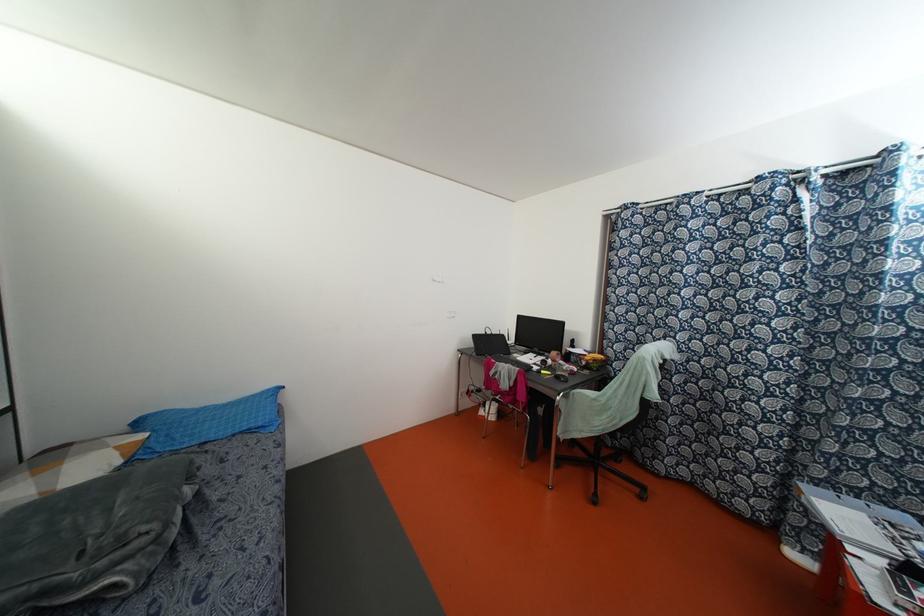
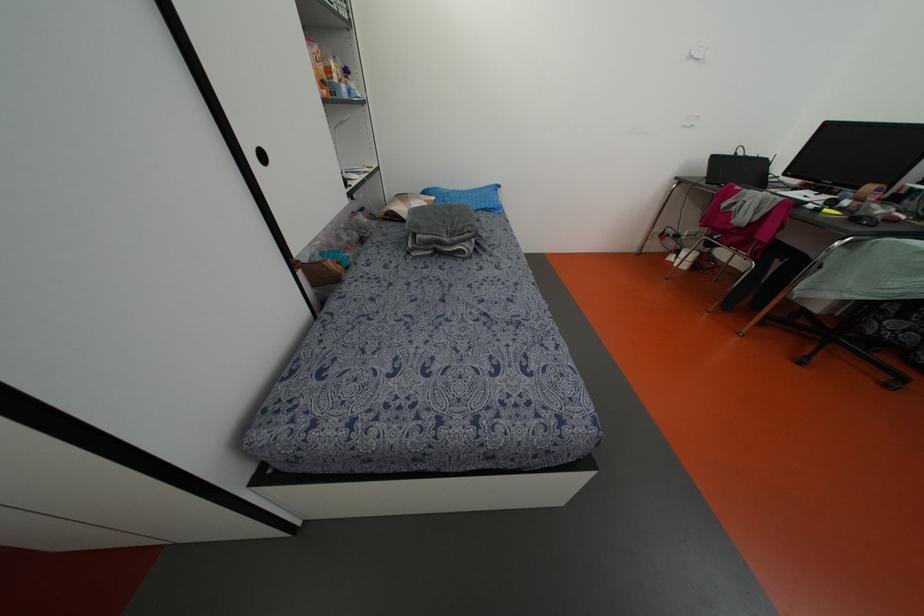
Locate, in the second image, the point that corresponds to pixel 259 424 in the first image.

(492, 206)